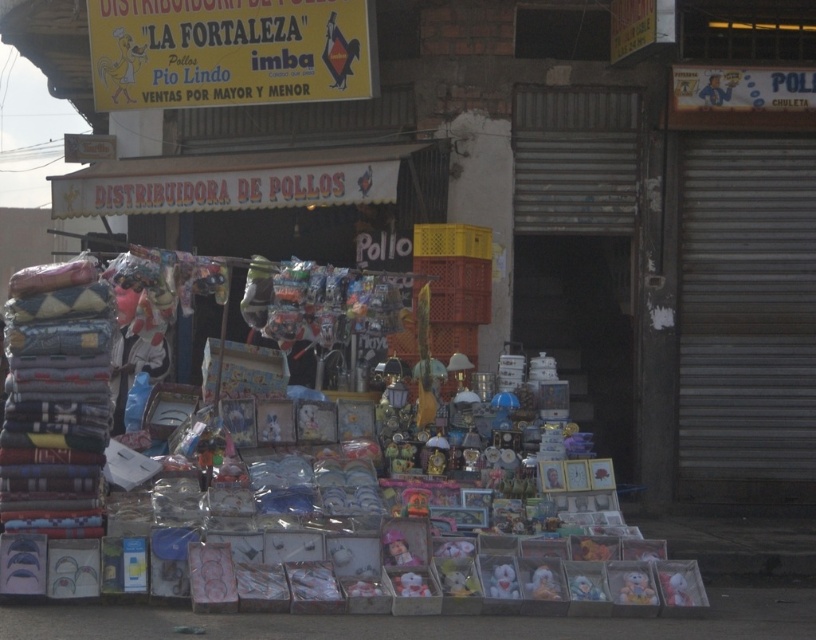
You are a customer at the market stall and want to buy a plush toy. You notice two options available. The fluffy plush toy at lower center and the plush toy at center. Which one is positioned to the right of the other?

The fluffy plush toy at lower center is positioned to the right of the plush toy at center.

You are standing at the entrance of the market stall and want to pick up two items located at the coordinates point (494, 596) and point (641, 593). Which item will you reach first?

The item at point (494, 596) will be reached first because it is closer to the viewer than the item at point (641, 593).